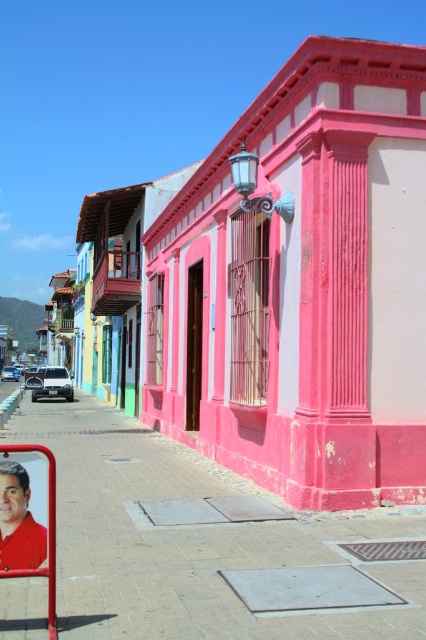
You are a tourist standing on the sidewalk and want to take a photo of the pink painted building at center and the smooth red shirt at lower left. Can you fit both in the frame without moving your camera? Explain why or why not.

The pink painted building at center is above the smooth red shirt at lower left, so they are vertically aligned. Since they are stacked vertically, you can fit both in the frame by adjusting the camera angle to include both the upper and lower parts of the scene.

From the picture: You are a delivery person standing at the pink painted building at center. You need to deliver a package to the smooth red shirt at lower left. The delivery robot you are using has a maximum range of 10 meters. Can the robot reach the destination?

The distance between the pink painted building at center and the smooth red shirt at lower left is 10.57 meters, which exceeds the robot maximum range of 10 meters. The robot cannot reach the destination.